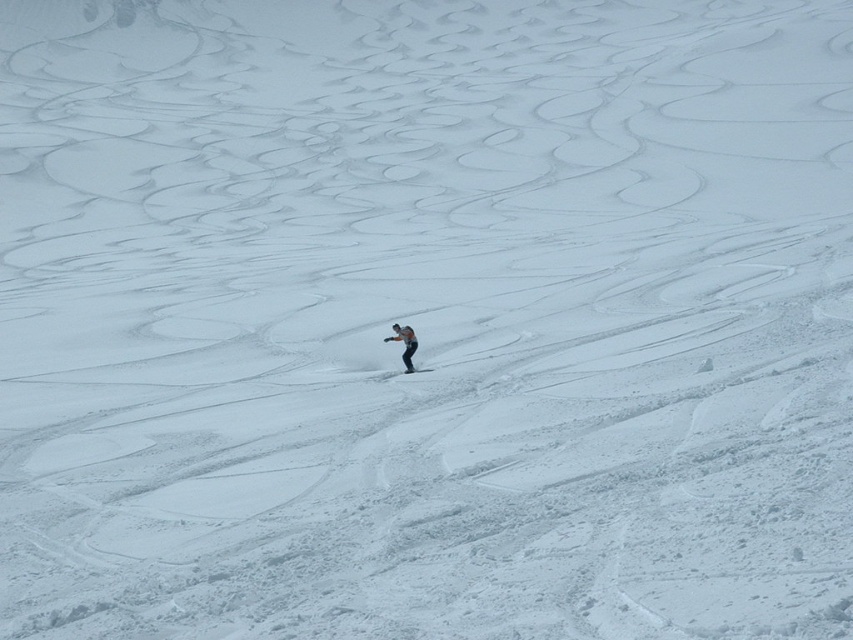
Looking at this image, you are a photographer trying to capture a clear shot of the gray fabric jacket at center and the black matte ski at center. Based on their positions, which object should you focus on first to ensure both are in focus?

The gray fabric jacket at center is above the black matte ski at center, so you should focus on the gray fabric jacket at center first to ensure both are in focus.

Looking at this image, you are a photographer trying to capture the skier in the snowy landscape. You notice the gray fabric jacket at center and the black matte ski at center. Which object should you focus on if you want to photograph the skier from the left side?

The gray fabric jacket at center is positioned on the left side of the black matte ski at center, so focusing on the gray fabric jacket at center would allow you to photograph the skier from the left side.